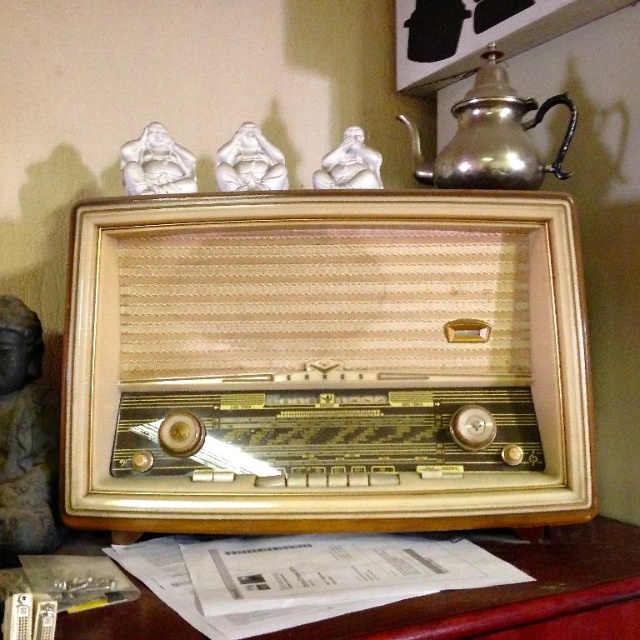
Does gold textured radio at center appear under white glossy statue at center?

Yes, gold textured radio at center is below white glossy statue at center.

Image resolution: width=640 pixels, height=640 pixels. Describe the element at coordinates (326, 362) in the screenshot. I see `gold textured radio at center` at that location.

Is point (381, 193) positioned in front of point (234, 176)?

Yes.

Identify the location of gold textured radio at center. (326, 362).

Can you confirm if brown wooden table at lower center is taller than white glossy statue at upper center?

In fact, brown wooden table at lower center may be shorter than white glossy statue at upper center.

Based on the photo, is the position of brown wooden table at lower center more distant than that of white glossy statue at upper center?

No, brown wooden table at lower center is in front of white glossy statue at upper center.

Is point (636, 538) positioned in front of point (369, 172)?

Yes.

Find the location of `brown wooden table at lower center`. brown wooden table at lower center is located at coordinates (518, 593).

Is brown wooden table at lower center behind white glossy figurine at upper center?

No, it is in front of white glossy figurine at upper center.

What are the coordinates of `brown wooden table at lower center` in the screenshot? It's located at (518, 593).